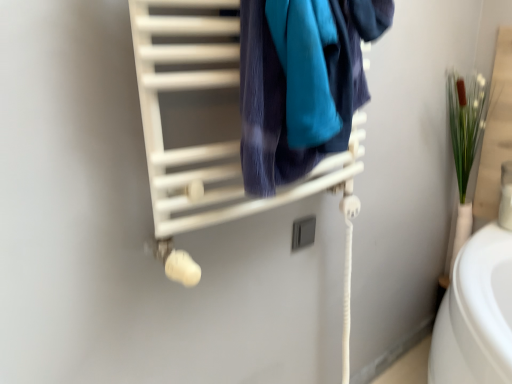
What is the approximate height of velvety blue towel at center?

35.74 centimeters.

Where is `velvety blue towel at center`? The image size is (512, 384). velvety blue towel at center is located at coordinates (301, 82).

What do you see at coordinates (301, 82) in the screenshot?
I see `velvety blue towel at center` at bounding box center [301, 82].

Find the location of a particular element. This screenshot has width=512, height=384. matte white towel rack at upper center is located at coordinates (216, 138).

This screenshot has height=384, width=512. Describe the element at coordinates (216, 138) in the screenshot. I see `matte white towel rack at upper center` at that location.

At what (x,y) coordinates should I click in order to perform the action: click on velvety blue towel at center. Please return your answer as a coordinate pair (x, y). The height and width of the screenshot is (384, 512). Looking at the image, I should click on (301, 82).

Based on the photo, considering the positions of objects velvety blue towel at center and matte white towel rack at upper center in the image provided, who is more to the right, velvety blue towel at center or matte white towel rack at upper center?

velvety blue towel at center is more to the right.

Is velvety blue towel at center further to the viewer compared to matte white towel rack at upper center?

Yes.

Which is farther, (304, 76) or (237, 189)?

The point (237, 189) is more distant.

From the image's perspective, is velvety blue towel at center positioned above or below matte white towel rack at upper center?

Clearly, from the image's perspective, velvety blue towel at center is above matte white towel rack at upper center.

From a real-world perspective, who is located lower, velvety blue towel at center or matte white towel rack at upper center?

matte white towel rack at upper center is physically lower.

Consider the image. Is velvety blue towel at center wider than matte white towel rack at upper center?

Indeed, velvety blue towel at center has a greater width compared to matte white towel rack at upper center.

Is velvety blue towel at center taller than matte white towel rack at upper center?

Yes, velvety blue towel at center is taller than matte white towel rack at upper center.

Based on their sizes in the image, would you say velvety blue towel at center is bigger or smaller than matte white towel rack at upper center?

velvety blue towel at center is bigger than matte white towel rack at upper center.

Do you think velvety blue towel at center is within matte white towel rack at upper center, or outside of it?

velvety blue towel at center is located beyond the bounds of matte white towel rack at upper center.

Are velvety blue towel at center and matte white towel rack at upper center located far from each other?

Actually, velvety blue towel at center and matte white towel rack at upper center are a little close together.

Does velvety blue towel at center turn towards matte white towel rack at upper center?

No.

How many degrees apart are the facing directions of velvety blue towel at center and matte white towel rack at upper center?

velvety blue towel at center and matte white towel rack at upper center are facing 0.000215 degrees away from each other.

Identify the location of closet that appears in front of the velvety blue towel at center. (216, 138).

Is matte white towel rack at upper center at the left side of velvety blue towel at center?

Correct, you'll find matte white towel rack at upper center to the left of velvety blue towel at center.

Considering the positions of objects matte white towel rack at upper center and velvety blue towel at center in the image provided, who is behind, matte white towel rack at upper center or velvety blue towel at center?

Positioned behind is velvety blue towel at center.

Which is behind, point (157, 103) or point (248, 91)?

Point (157, 103)

From the image's perspective, is matte white towel rack at upper center under velvety blue towel at center?

Indeed, from the image's perspective, matte white towel rack at upper center is shown beneath velvety blue towel at center.

From a real-world perspective, which object rests below the other?

matte white towel rack at upper center.

Considering the sizes of objects matte white towel rack at upper center and velvety blue towel at center in the image provided, who is wider, matte white towel rack at upper center or velvety blue towel at center?

With larger width is velvety blue towel at center.

From their relative heights in the image, would you say matte white towel rack at upper center is taller or shorter than velvety blue towel at center?

Considering their sizes, matte white towel rack at upper center has less height than velvety blue towel at center.

Who is bigger, matte white towel rack at upper center or velvety blue towel at center?

Bigger between the two is velvety blue towel at center.

Would you say matte white towel rack at upper center is inside or outside velvety blue towel at center?

matte white towel rack at upper center is spatially situated outside velvety blue towel at center.

Does matte white towel rack at upper center touch velvety blue towel at center?

No, matte white towel rack at upper center is not next to velvety blue towel at center.

Is matte white towel rack at upper center facing away from velvety blue towel at center?

matte white towel rack at upper center is not turned away from velvety blue towel at center.

Consider the image. Can you tell me how much matte white towel rack at upper center and velvety blue towel at center differ in facing direction?

The angle between the facing direction of matte white towel rack at upper center and the facing direction of velvety blue towel at center is 0.000215 degrees.

Identify the location of closet that is below the velvety blue towel at center (from the image's perspective). The height and width of the screenshot is (384, 512). (216, 138).

Where is `closet in front of the velvety blue towel at center`? The width and height of the screenshot is (512, 384). closet in front of the velvety blue towel at center is located at coordinates click(x=216, y=138).

I want to click on closet located below the velvety blue towel at center (from the image's perspective), so click(x=216, y=138).